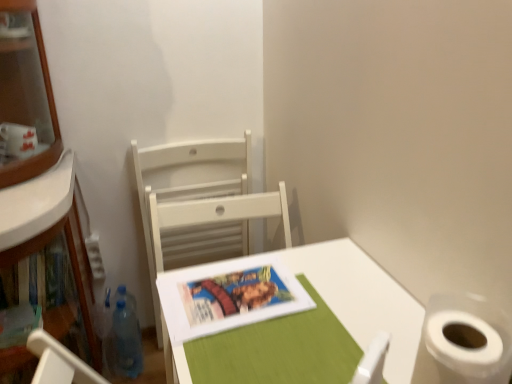
Question: From a real-world perspective, is transparent plastic bottle at lower left physically above white matte table at center?

Choices:
 (A) no
 (B) yes

Answer: (A)

Question: From the image's perspective, is transparent plastic bottle at lower left below white matte table at center?

Choices:
 (A) no
 (B) yes

Answer: (B)

Question: Is transparent plastic bottle at lower left in contact with white matte table at center?

Choices:
 (A) yes
 (B) no

Answer: (B)

Question: Is white matte table at center a part of transparent plastic bottle at lower left?

Choices:
 (A) no
 (B) yes

Answer: (A)

Question: From a real-world perspective, is transparent plastic bottle at lower left under white matte table at center?

Choices:
 (A) yes
 (B) no

Answer: (A)

Question: Relative to matte paper book cover at center, is white matte table at center in front or behind?

Choices:
 (A) behind
 (B) front

Answer: (B)

Question: From the image's perspective, is white matte table at center located above or below matte paper book cover at center?

Choices:
 (A) above
 (B) below

Answer: (B)

Question: Is white matte table at center situated inside matte paper book cover at center or outside?

Choices:
 (A) outside
 (B) inside

Answer: (A)

Question: Considering the positions of white matte table at center and matte paper book cover at center in the image, is white matte table at center wider or thinner than matte paper book cover at center?

Choices:
 (A) wide
 (B) thin

Answer: (A)

Question: From a real-world perspective, is white matte table at center physically located above or below white wood chair at center?

Choices:
 (A) below
 (B) above

Answer: (B)

Question: Is point (409, 309) positioned closer to the camera than point (209, 155)?

Choices:
 (A) farther
 (B) closer

Answer: (B)

Question: Would you say white matte table at center is to the left or to the right of white wood chair at center in the picture?

Choices:
 (A) right
 (B) left

Answer: (A)

Question: From their relative heights in the image, would you say white matte table at center is taller or shorter than white wood chair at center?

Choices:
 (A) short
 (B) tall

Answer: (A)

Question: Considering the positions of white wood chair at center and transparent plastic bottle at lower left in the image, is white wood chair at center bigger or smaller than transparent plastic bottle at lower left?

Choices:
 (A) big
 (B) small

Answer: (A)

Question: Is white wood chair at center taller or shorter than transparent plastic bottle at lower left?

Choices:
 (A) short
 (B) tall

Answer: (B)